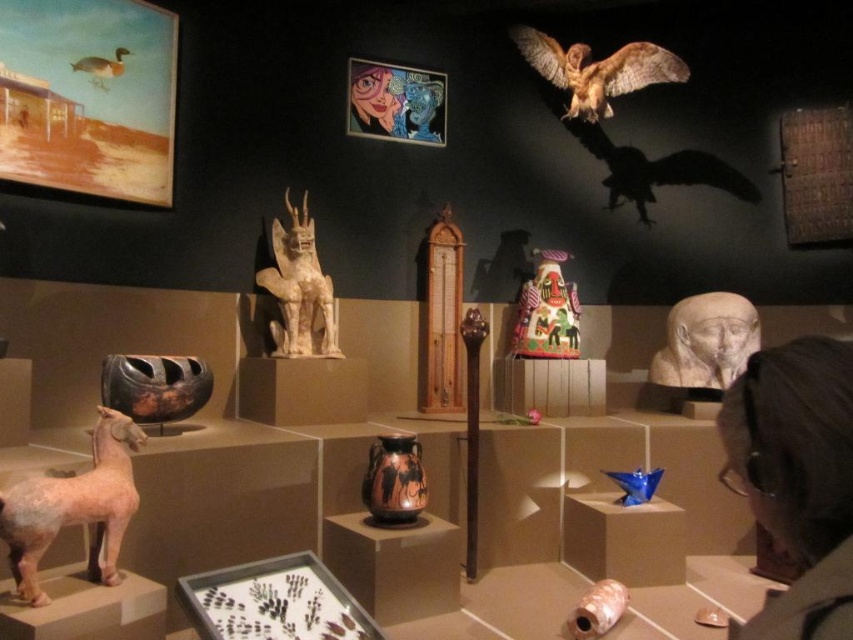
Does matte pink statue at lower left appear on the left side of brown feathered owl at upper right?

Indeed, matte pink statue at lower left is positioned on the left side of brown feathered owl at upper right.

Is matte pink statue at lower left to the right of brown feathered owl at upper right from the viewer's perspective?

No, matte pink statue at lower left is not to the right of brown feathered owl at upper right.

This screenshot has width=853, height=640. What do you see at coordinates (74, 508) in the screenshot?
I see `matte pink statue at lower left` at bounding box center [74, 508].

At what (x,y) coordinates should I click in order to perform the action: click on matte pink statue at lower left. Please return your answer as a coordinate pair (x, y). The width and height of the screenshot is (853, 640). Looking at the image, I should click on (74, 508).

Which of these two, dark hair at upper right or matte plastic mask at upper center, stands shorter?

dark hair at upper right

You are a GUI agent. You are given a task and a screenshot of the screen. Output one action in this format:
    pyautogui.click(x=<x>, y=<y>)
    Task: Click on the dark hair at upper right
    
    Given the screenshot: What is the action you would take?
    pyautogui.click(x=798, y=477)

How distant is dark hair at upper right from brown matte duck at upper left?

dark hair at upper right is 3.55 meters away from brown matte duck at upper left.

Is dark hair at upper right smaller than brown matte duck at upper left?

Incorrect, dark hair at upper right is not smaller in size than brown matte duck at upper left.

In order to click on dark hair at upper right in this screenshot , I will do `click(798, 477)`.